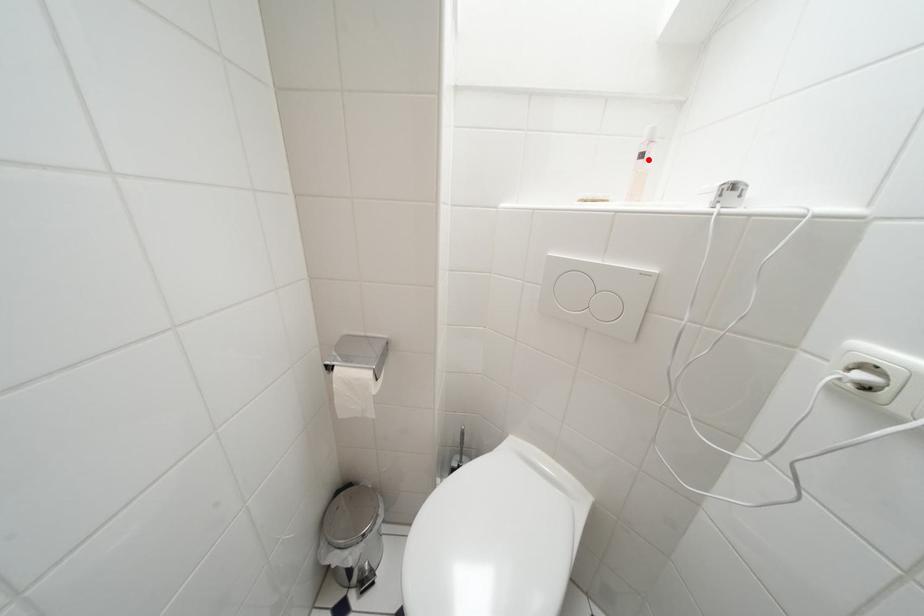
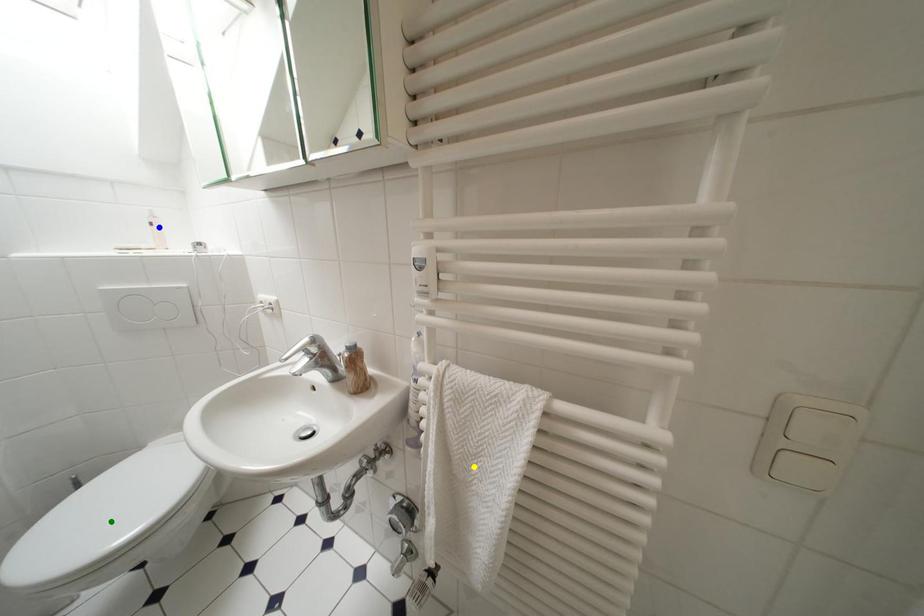
Question: I am providing you with two images of the same scene from different viewpoints. A red point is marked on the first image. You are given multiple points on the second image. Which spot in image 2 lines up with the point in image 1?

Choices:
 (A) green point
 (B) yellow point
 (C) blue point

Answer: (C)